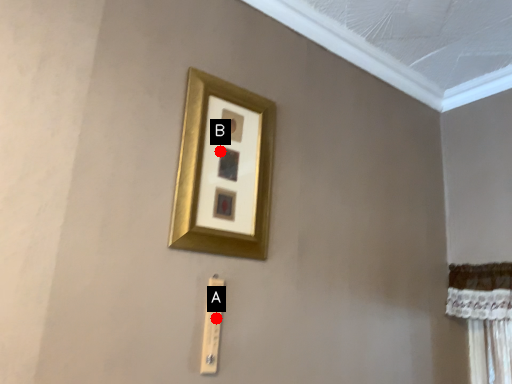
Question: Two points are circled on the image, labeled by A and B beside each circle. Which point is farther from the camera taking this photo?

Choices:
 (A) A is further
 (B) B is further

Answer: (B)